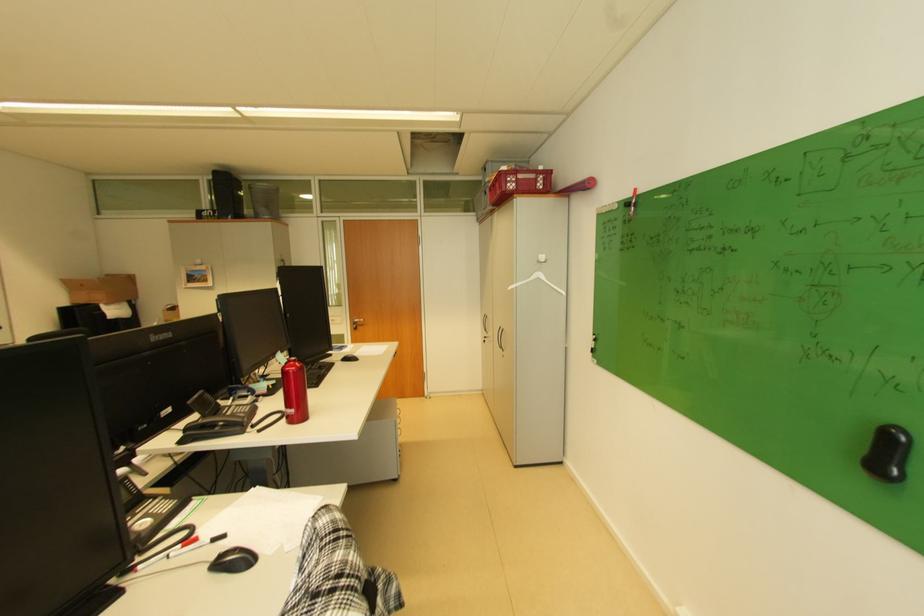
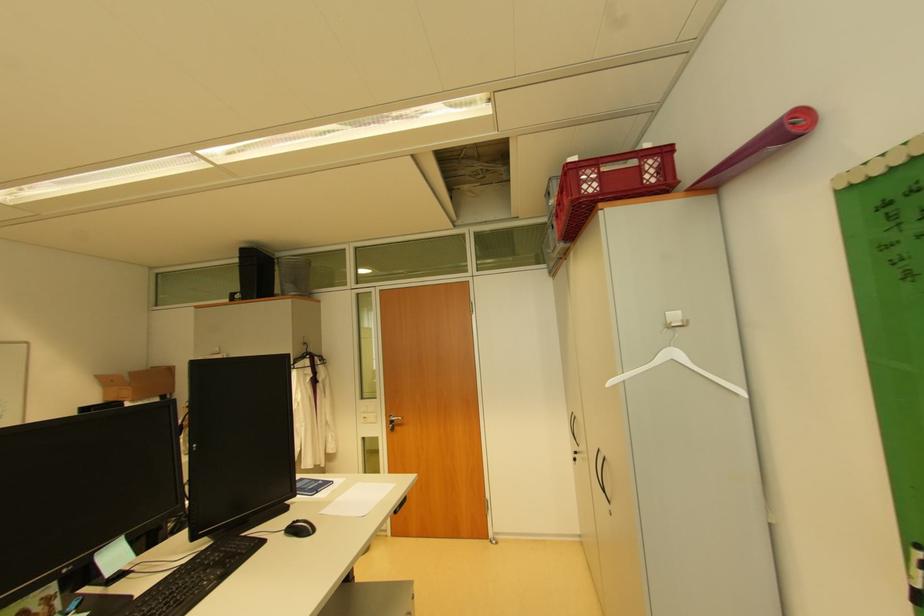
Question: In a continuous first-person perspective shot, in which direction is the camera moving?

Choices:
 (A) Left
 (B) Right
 (C) Forward
 (D) Backward

Answer: (C)